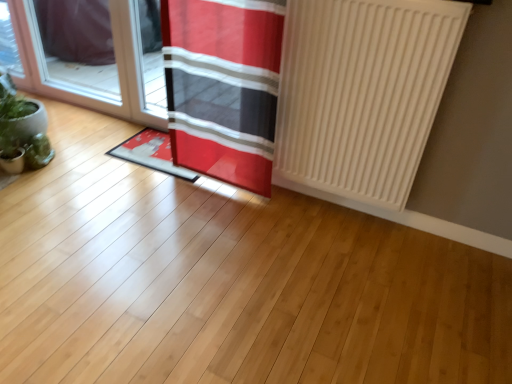
Identify the location of vacant area that is situated to the right of green matte plant at left. The height and width of the screenshot is (384, 512). (70, 180).